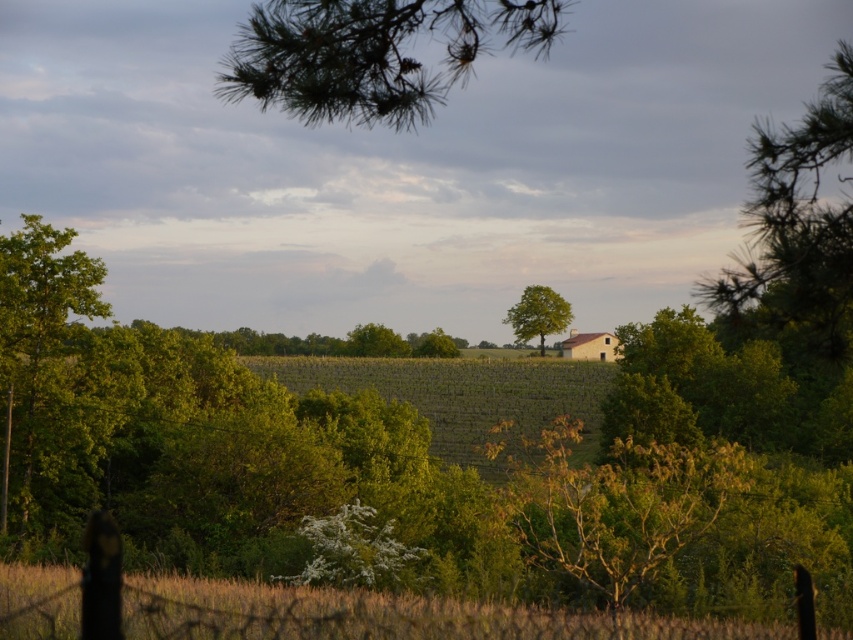
Question: Does green leafy tree at left have a larger size compared to green leafy tree at center?

Choices:
 (A) yes
 (B) no

Answer: (B)

Question: Based on their relative distances, which object is farther from the green leafy tree at left?

Choices:
 (A) green leafy tree at center
 (B) green needle-like at upper center

Answer: (A)

Question: Is brown wire fence at lower center positioned behind green needle-like at upper center?

Choices:
 (A) yes
 (B) no

Answer: (B)

Question: Considering the real-world distances, which object is closest to the green leafy tree at center?

Choices:
 (A) brown wire fence at lower center
 (B) green leafy tree at left

Answer: (B)

Question: Which of these objects is positioned farthest from the green needle-like at upper center?

Choices:
 (A) brown wire fence at lower center
 (B) green leafy tree at left
 (C) green leafy tree at center

Answer: (C)

Question: Can you confirm if brown wire fence at lower center is positioned to the left of green leafy tree at center?

Choices:
 (A) yes
 (B) no

Answer: (A)